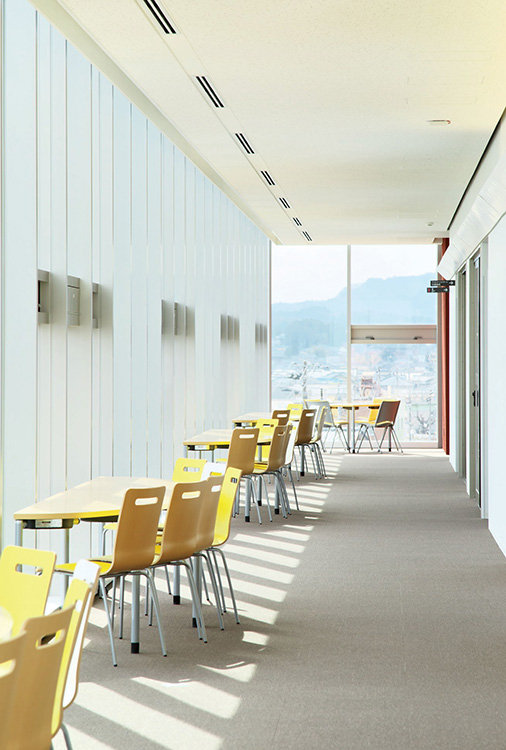
Image resolution: width=506 pixels, height=750 pixels. Find the location of `air vents`. air vents is located at coordinates (x=168, y=16), (x=213, y=91), (x=240, y=140), (x=258, y=172), (x=281, y=196), (x=298, y=220), (x=305, y=240).